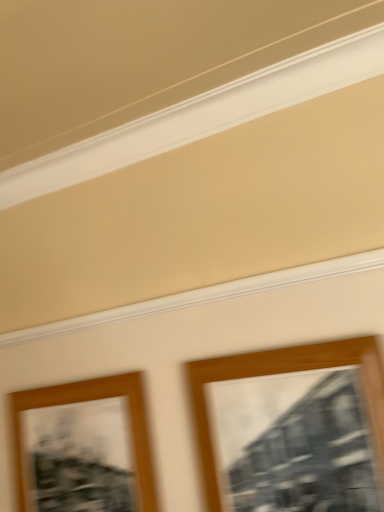
Image resolution: width=384 pixels, height=512 pixels. Describe the element at coordinates (278, 373) in the screenshot. I see `wooden picture frame at center, which appears as the 1th picture frame when viewed from the front` at that location.

You are a GUI agent. You are given a task and a screenshot of the screen. Output one action in this format:
    pyautogui.click(x=<x>, y=<y>)
    Task: Click on the wooden picture frame at center, which appears as the 1th picture frame when viewed from the front
    This screenshot has width=384, height=512.
    Given the screenshot: What is the action you would take?
    pyautogui.click(x=278, y=373)

How much space does wooden picture frame at lower left, which is the 1th picture frame in back-to-front order, occupy vertically?

The height of wooden picture frame at lower left, which is the 1th picture frame in back-to-front order, is 15.31 inches.

What do you see at coordinates (84, 447) in the screenshot?
I see `wooden picture frame at lower left, placed as the 2th picture frame when sorted from right to left` at bounding box center [84, 447].

This screenshot has width=384, height=512. Find the location of `wooden picture frame at lower left, arranged as the 2th picture frame when viewed from the front`. wooden picture frame at lower left, arranged as the 2th picture frame when viewed from the front is located at coordinates (84, 447).

Where is `wooden picture frame at center, the 2th picture frame when ordered from back to front`? This screenshot has width=384, height=512. wooden picture frame at center, the 2th picture frame when ordered from back to front is located at coordinates (278, 373).

Is wooden picture frame at lower left, which is the 1th picture frame in back-to-front order, to the right of wooden picture frame at center, the 1th picture frame from the right, from the viewer's perspective?

In fact, wooden picture frame at lower left, which is the 1th picture frame in back-to-front order, is to the left of wooden picture frame at center, the 1th picture frame from the right.

Does wooden picture frame at lower left, placed as the 2th picture frame when sorted from right to left, lie in front of wooden picture frame at center, which appears as the 1th picture frame when viewed from the front?

No, it is behind wooden picture frame at center, which appears as the 1th picture frame when viewed from the front.

Between point (81, 404) and point (273, 350), which one is positioned in front?

The point (273, 350) is closer.

From the image's perspective, who appears lower, wooden picture frame at lower left, arranged as the 2th picture frame when viewed from the front, or wooden picture frame at center, which appears as the 1th picture frame when viewed from the front?

wooden picture frame at lower left, arranged as the 2th picture frame when viewed from the front, from the image's perspective.

From a real-world perspective, is wooden picture frame at lower left, placed as the 2th picture frame when sorted from right to left, on wooden picture frame at center, which ranks as the second picture frame in left-to-right order?

Incorrect, from a real-world perspective, wooden picture frame at lower left, placed as the 2th picture frame when sorted from right to left, is lower than wooden picture frame at center, which ranks as the second picture frame in left-to-right order.

Does wooden picture frame at lower left, which is the 1th picture frame in back-to-front order, have a greater width compared to wooden picture frame at center, which appears as the 1th picture frame when viewed from the front?

In fact, wooden picture frame at lower left, which is the 1th picture frame in back-to-front order, might be narrower than wooden picture frame at center, which appears as the 1th picture frame when viewed from the front.

In terms of height, does wooden picture frame at lower left, arranged as the 2th picture frame when viewed from the front, look taller or shorter compared to wooden picture frame at center, the 1th picture frame from the right?

In the image, wooden picture frame at lower left, arranged as the 2th picture frame when viewed from the front, appears to be shorter than wooden picture frame at center, the 1th picture frame from the right.

In terms of size, does wooden picture frame at lower left, placed as the 2th picture frame when sorted from right to left, appear bigger or smaller than wooden picture frame at center, which ranks as the second picture frame in left-to-right order?

Considering their sizes, wooden picture frame at lower left, placed as the 2th picture frame when sorted from right to left, takes up less space than wooden picture frame at center, which ranks as the second picture frame in left-to-right order.

In the scene shown: Is wooden picture frame at lower left, which is the 1th picture frame in back-to-front order, inside or outside of wooden picture frame at center, which ranks as the second picture frame in left-to-right order?

wooden picture frame at lower left, which is the 1th picture frame in back-to-front order, is spatially situated outside wooden picture frame at center, which ranks as the second picture frame in left-to-right order.

Would you consider wooden picture frame at lower left, arranged as the 2th picture frame when viewed from the front, to be distant from wooden picture frame at center, the 2th picture frame when ordered from back to front?

No, wooden picture frame at lower left, arranged as the 2th picture frame when viewed from the front, is not far away from wooden picture frame at center, the 2th picture frame when ordered from back to front.

Is wooden picture frame at center, the 2th picture frame when ordered from back to front, at the back of wooden picture frame at lower left, which is the 1th picture frame in back-to-front order?

No, wooden picture frame at lower left, which is the 1th picture frame in back-to-front order, is not facing away from wooden picture frame at center, the 2th picture frame when ordered from back to front.

What's the angular difference between wooden picture frame at lower left, placed as the 2th picture frame when sorted from right to left, and wooden picture frame at center, the 2th picture frame when ordered from back to front,'s facing directions?

wooden picture frame at lower left, placed as the 2th picture frame when sorted from right to left, and wooden picture frame at center, the 2th picture frame when ordered from back to front, are facing 0.403 degrees away from each other.

Identify the location of picture frame above the wooden picture frame at lower left, which is the 1th picture frame in back-to-front order (from the image's perspective). (278, 373).

Is wooden picture frame at center, which ranks as the second picture frame in left-to-right order, to the right of wooden picture frame at lower left, which is the 1th picture frame in back-to-front order, from the viewer's perspective?

Indeed, wooden picture frame at center, which ranks as the second picture frame in left-to-right order, is positioned on the right side of wooden picture frame at lower left, which is the 1th picture frame in back-to-front order.

Does wooden picture frame at center, the 2th picture frame when ordered from back to front, lie in front of wooden picture frame at lower left, arranged as the 2th picture frame when viewed from the front?

That is True.

Considering the positions of point (307, 368) and point (66, 490), is point (307, 368) closer or farther from the camera than point (66, 490)?

Clearly, point (307, 368) is closer to the camera than point (66, 490).

From the image's perspective, would you say wooden picture frame at center, which appears as the 1th picture frame when viewed from the front, is positioned over wooden picture frame at lower left, placed as the 2th picture frame when sorted from right to left?

Correct, wooden picture frame at center, which appears as the 1th picture frame when viewed from the front, appears higher than wooden picture frame at lower left, placed as the 2th picture frame when sorted from right to left, in the image.

From a real-world perspective, is wooden picture frame at center, which appears as the 1th picture frame when viewed from the front, located higher than wooden picture frame at lower left, which is the first picture frame from left to right?

Yes, from a real-world perspective, wooden picture frame at center, which appears as the 1th picture frame when viewed from the front, is above wooden picture frame at lower left, which is the first picture frame from left to right.

Does wooden picture frame at center, which ranks as the second picture frame in left-to-right order, have a greater width compared to wooden picture frame at lower left, arranged as the 2th picture frame when viewed from the front?

Yes.

Considering the sizes of objects wooden picture frame at center, the 1th picture frame from the right, and wooden picture frame at lower left, arranged as the 2th picture frame when viewed from the front, in the image provided, who is taller, wooden picture frame at center, the 1th picture frame from the right, or wooden picture frame at lower left, arranged as the 2th picture frame when viewed from the front,?

wooden picture frame at center, the 1th picture frame from the right.

Considering the sizes of objects wooden picture frame at center, the 2th picture frame when ordered from back to front, and wooden picture frame at lower left, which is the 1th picture frame in back-to-front order, in the image provided, who is smaller, wooden picture frame at center, the 2th picture frame when ordered from back to front, or wooden picture frame at lower left, which is the 1th picture frame in back-to-front order,?

Smaller between the two is wooden picture frame at lower left, which is the 1th picture frame in back-to-front order.

Does wooden picture frame at center, the 1th picture frame from the right, contain wooden picture frame at lower left, placed as the 2th picture frame when sorted from right to left?

No, wooden picture frame at lower left, placed as the 2th picture frame when sorted from right to left, is not inside wooden picture frame at center, the 1th picture frame from the right.

Is wooden picture frame at center, which appears as the 1th picture frame when viewed from the front, directly adjacent to wooden picture frame at lower left, placed as the 2th picture frame when sorted from right to left?

wooden picture frame at center, which appears as the 1th picture frame when viewed from the front, is not next to wooden picture frame at lower left, placed as the 2th picture frame when sorted from right to left, and they're not touching.

Could you tell me if wooden picture frame at center, which appears as the 1th picture frame when viewed from the front, is facing wooden picture frame at lower left, arranged as the 2th picture frame when viewed from the front?

No, wooden picture frame at center, which appears as the 1th picture frame when viewed from the front, does not turn towards wooden picture frame at lower left, arranged as the 2th picture frame when viewed from the front.

In the scene shown: Can you tell me how much wooden picture frame at center, which appears as the 1th picture frame when viewed from the front, and wooden picture frame at lower left, which is the first picture frame from left to right, differ in facing direction?

They differ by 0.403 degrees in their facing directions.

How distant is wooden picture frame at center, the 2th picture frame when ordered from back to front, from wooden picture frame at lower left, which is the first picture frame from left to right?

A distance of 15.07 inches exists between wooden picture frame at center, the 2th picture frame when ordered from back to front, and wooden picture frame at lower left, which is the first picture frame from left to right.

Locate an element on the screen. This screenshot has width=384, height=512. picture frame lying below the wooden picture frame at center, the 2th picture frame when ordered from back to front (from the image's perspective) is located at coordinates (84, 447).

Find the location of a particular element. This screenshot has height=512, width=384. picture frame above the wooden picture frame at lower left, arranged as the 2th picture frame when viewed from the front (from the image's perspective) is located at coordinates (278, 373).

Where is `picture frame on the right of wooden picture frame at lower left, which is the 1th picture frame in back-to-front order`? picture frame on the right of wooden picture frame at lower left, which is the 1th picture frame in back-to-front order is located at coordinates (278, 373).